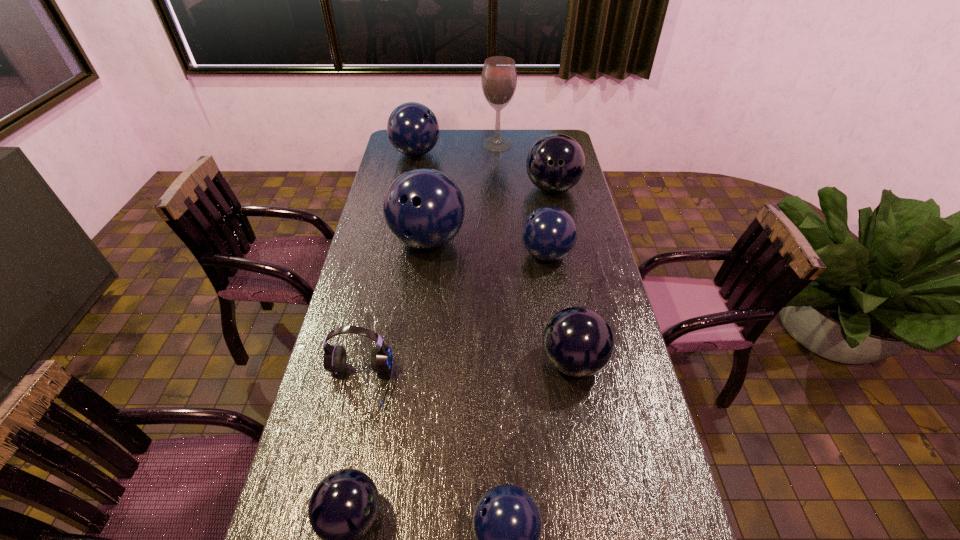
You are a GUI agent. You are given a task and a screenshot of the screen. Output one action in this format:
    pyautogui.click(x=<x>, y=<y>)
    Task: Click on the second biggest black bowling ball
    The width and height of the screenshot is (960, 540).
    Given the screenshot: What is the action you would take?
    pyautogui.click(x=578, y=341)

In order to click on headset in this screenshot , I will do `click(335, 356)`.

In order to click on vacant area situated 0.230m on the right of the tallest object in this screenshot , I will do `click(561, 144)`.

Where is `vacant area located on the surface of the eighth shortest object near the finger holes`? This screenshot has width=960, height=540. vacant area located on the surface of the eighth shortest object near the finger holes is located at coordinates (421, 292).

This screenshot has width=960, height=540. What are the coordinates of `vacant space situated on the surface of the farthest bowling ball near the finger holes` in the screenshot? It's located at (502, 153).

Identify the location of vacant space situated 0.360m on the side of the farthest black bowling ball with the finger holes. This screenshot has width=960, height=540. (567, 265).

You are a GUI agent. You are given a task and a screenshot of the screen. Output one action in this format:
    pyautogui.click(x=<x>, y=<y>)
    Task: Click on the vacant position located 0.060m on the surface of the rightmost blue bowling ball near the finger holes
    The height and width of the screenshot is (540, 960).
    Given the screenshot: What is the action you would take?
    pyautogui.click(x=503, y=254)

I want to click on vacant point located 0.350m on the surface of the rightmost blue bowling ball near the finger holes, so click(423, 254).

You are a GUI agent. You are given a task and a screenshot of the screen. Output one action in this format:
    pyautogui.click(x=<x>, y=<y>)
    Task: Click on the free space located 0.100m on the surface of the rightmost blue bowling ball near the finger holes
    
    Given the screenshot: What is the action you would take?
    pyautogui.click(x=492, y=254)

At what (x,y) coordinates should I click in order to perform the action: click on vacant position located on the side of the fifth farthest bowling ball with the finger holes. Please return your answer as a coordinate pair (x, y). The width and height of the screenshot is (960, 540). Looking at the image, I should click on (505, 362).